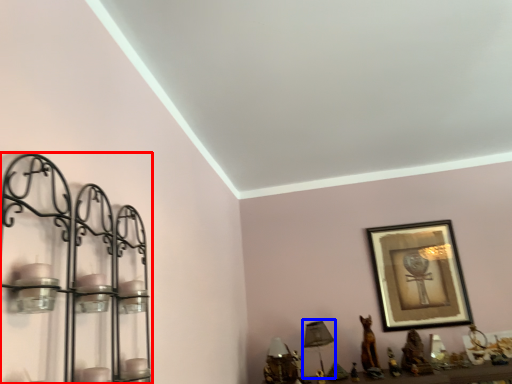
Question: Which object appears farthest to the camera in this image, shelf (highlighted by a red box) or table lamp (highlighted by a blue box)?

Choices:
 (A) shelf
 (B) table lamp

Answer: (B)